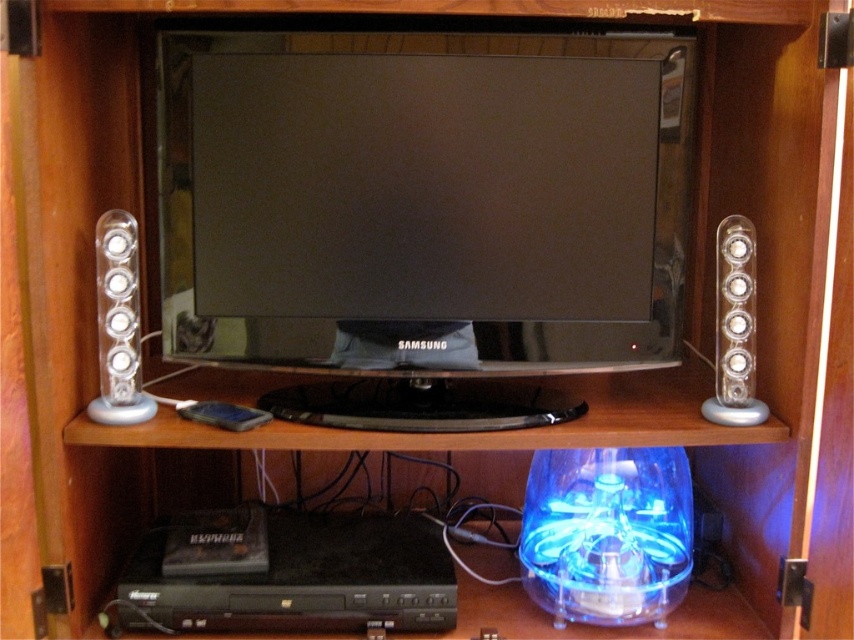
Consider the image. Does clear plastic speaker at left have a greater height compared to clear plastic speaker at right?

Correct, clear plastic speaker at left is much taller as clear plastic speaker at right.

Which is above, clear plastic speaker at left or clear plastic speaker at right?

Positioned higher is clear plastic speaker at right.

Is point (127, 416) farther from viewer compared to point (747, 356)?

No, (127, 416) is in front of (747, 356).

At what (x,y) coordinates should I click in order to perform the action: click on clear plastic speaker at left. Please return your answer as a coordinate pair (x, y). The image size is (854, 640). Looking at the image, I should click on (118, 323).

Is satin black flat screen at center bigger than clear plastic speaker at right?

Correct, satin black flat screen at center is larger in size than clear plastic speaker at right.

Based on the photo, is satin black flat screen at center to the right of clear plastic speaker at right from the viewer's perspective?

Incorrect, satin black flat screen at center is not on the right side of clear plastic speaker at right.

This screenshot has height=640, width=854. Find the location of `satin black flat screen at center`. satin black flat screen at center is located at coordinates (423, 198).

Locate an element on the screen. satin black flat screen at center is located at coordinates (423, 198).

Does satin black flat screen at center have a smaller size compared to clear plastic speaker at left?

Incorrect, satin black flat screen at center is not smaller in size than clear plastic speaker at left.

Who is more forward, (640, 83) or (97, 257)?

Positioned in front is point (640, 83).

Where is `satin black flat screen at center`? The height and width of the screenshot is (640, 854). satin black flat screen at center is located at coordinates (423, 198).